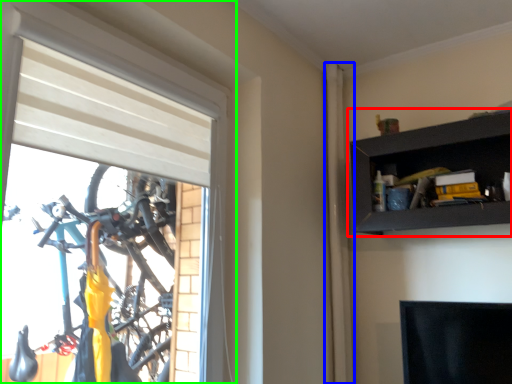
Question: Which object is the closest to the shelf (highlighted by a red box)? Choose among these: curtain (highlighted by a blue box) or window (highlighted by a green box).

Choices:
 (A) curtain
 (B) window

Answer: (A)